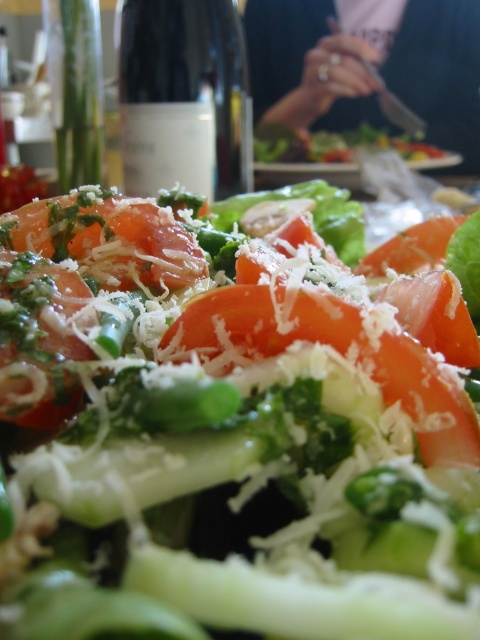
Between tomato with grated cheese at center and tomato with green herbs and grated cheese at center, which one is positioned lower?

tomato with grated cheese at center is below.

From the picture: Does tomato with grated cheese at center appear under tomato with green herbs and grated cheese at center?

Yes, tomato with grated cheese at center is below tomato with green herbs and grated cheese at center.

Is point (252, 298) positioned after point (15, 406)?

Yes, point (252, 298) is behind point (15, 406).

This screenshot has width=480, height=640. In order to click on tomato with grated cheese at center in this screenshot , I will do `click(336, 349)`.

Does point (393, 396) come farther from viewer compared to point (39, 205)?

That is False.

Does tomato with grated cheese at center have a greater width compared to shiny orange tomato at center?

In fact, tomato with grated cheese at center might be narrower than shiny orange tomato at center.

Which is in front, point (179, 321) or point (54, 252)?

Point (179, 321)

Find the location of a particular element. tomato with grated cheese at center is located at coordinates (336, 349).

Does shiny orange tomato at center appear on the left side of tomato with green herbs and grated cheese at center?

Yes, shiny orange tomato at center is to the left of tomato with green herbs and grated cheese at center.

Is shiny orange tomato at center positioned in front of tomato with green herbs and grated cheese at center?

No, shiny orange tomato at center is behind tomato with green herbs and grated cheese at center.

This screenshot has width=480, height=640. I want to click on shiny orange tomato at center, so click(x=108, y=237).